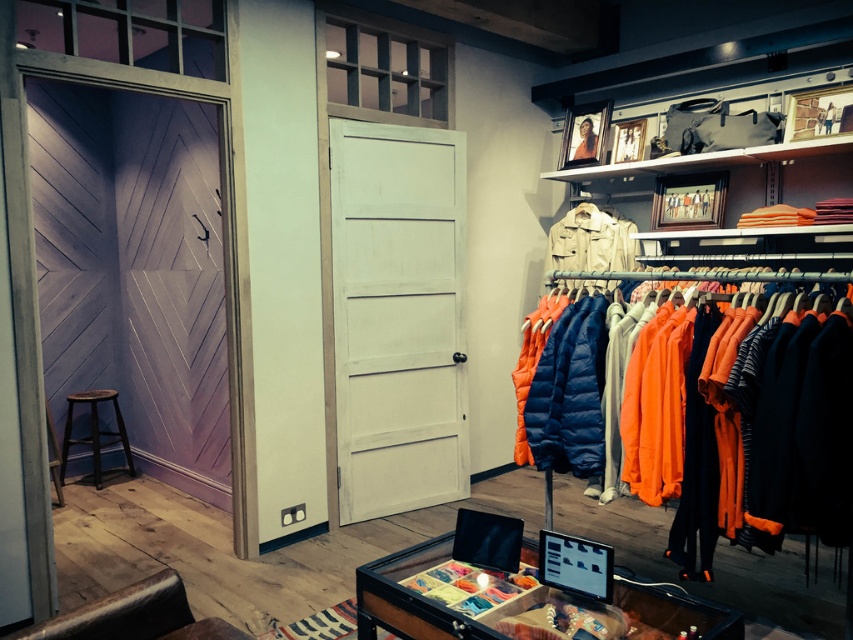
You are a customer in the store and want to try on the khaki canvas jacket at center. Where is the black wood stool at lower left located in relation to the jacket?

The khaki canvas jacket at center is positioned over the black wood stool at lower left, meaning the stool is beneath the jacket and likely not accessible for sitting while the jacket is displayed.

You are a customer in the store and want to try on the orange quilted jacket at right. The black wood stool at lower left is available. Can you sit on the stool while trying on the jacket?

The orange quilted jacket at right is bigger than the black wood stool at lower left, so yes, you can sit on the black wood stool at lower left while trying on the jacket since the stool is smaller and likely stable enough to support you.

You are a customer in the store and want to pick up both the orange quilted jacket at right and the khaki canvas jacket at center. Which jacket should you move towards first if you are standing near the left side of the store?

You should move towards the orange quilted jacket at right first because it is to the left of the khaki canvas jacket at center, so it is closer to your current position near the left side of the store.